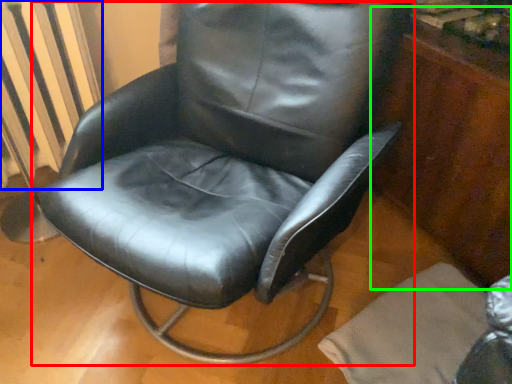
Question: Considering the real-world distances, which object is farthest from chair (highlighted by a red box)? radiator (highlighted by a blue box) or dresser (highlighted by a green box)?

Choices:
 (A) radiator
 (B) dresser

Answer: (B)